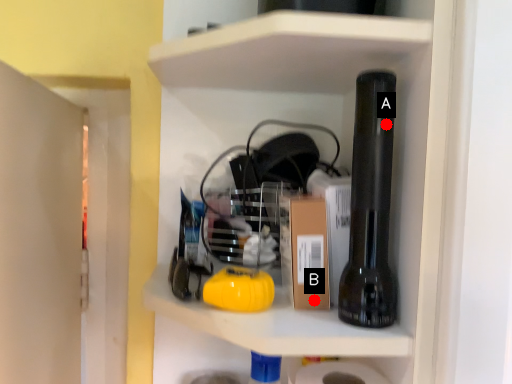
Question: Two points are circled on the image, labeled by A and B beside each circle. Among these points, which one is farthest from the camera?

Choices:
 (A) A is further
 (B) B is further

Answer: (B)